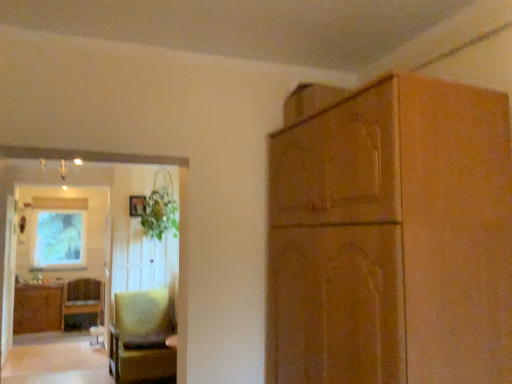
Question: Choose the correct answer: Is matte green painting at upper left inside wooden cabinet at upper right, which is the 2th cabinetry in bottom-to-top order, or outside it?

Choices:
 (A) inside
 (B) outside

Answer: (B)

Question: Based on their positions, is matte green painting at upper left located to the left or right of wooden cabinet at upper right, which is the first cabinetry in top-to-bottom order?

Choices:
 (A) left
 (B) right

Answer: (A)

Question: Which object is positioned farthest from the velvet yellow chair at lower left, which appears as the second chair when viewed from the back?

Choices:
 (A) wooden cabinet at upper right, placed as the second cabinetry when sorted from back to front
 (B) matte green painting at upper left
 (C) wooden chair at lower left, the second chair viewed from the right
 (D) woven wicker cabinet at lower left, which is the 2th cabinetry from right to left
 (E) green leafy plant at upper left

Answer: (A)

Question: Estimate the real-world distances between objects in this image. Which object is closer to the woven wicker cabinet at lower left, arranged as the first cabinetry when ordered from the bottom?

Choices:
 (A) velvet yellow chair at lower left, acting as the first chair starting from the front
 (B) wooden chair at lower left, the first chair when ordered from left to right
 (C) wooden cabinet at upper right, which is the 2th cabinetry in bottom-to-top order
 (D) green leafy plant at upper left
 (E) matte green painting at upper left

Answer: (B)